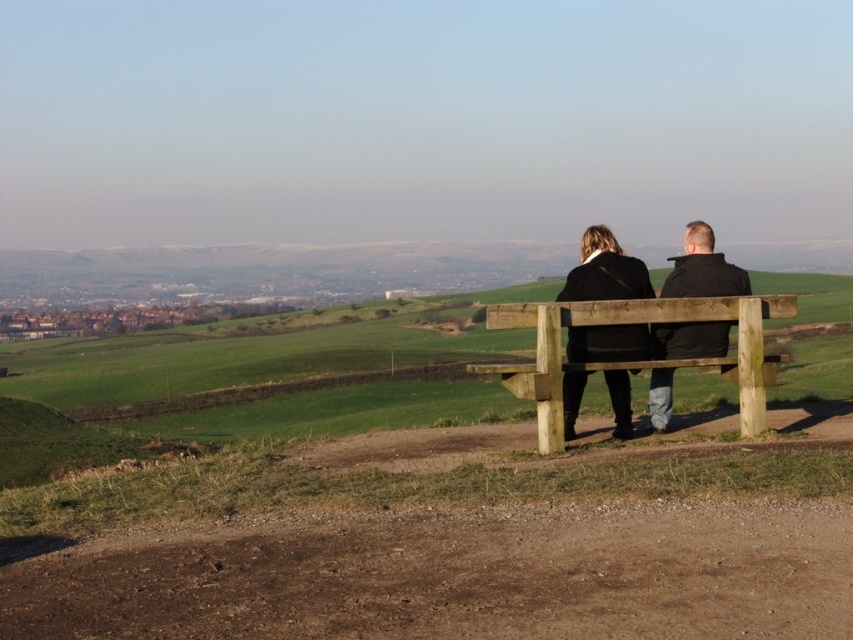
Question: Does black matte coat at center have a lesser width compared to black leather jacket at center?

Choices:
 (A) no
 (B) yes

Answer: (A)

Question: Considering the relative positions of wooden bench at center and black matte coat at center in the image provided, where is wooden bench at center located with respect to black matte coat at center?

Choices:
 (A) above
 (B) below

Answer: (A)

Question: Is wooden bench at center wider than black leather jacket at center?

Choices:
 (A) no
 (B) yes

Answer: (B)

Question: Which of the following is the farthest from the observer?

Choices:
 (A) (645, 269)
 (B) (648, 401)

Answer: (B)

Question: Which of the following is the farthest from the observer?

Choices:
 (A) wooden bench at center
 (B) black matte coat at center

Answer: (B)

Question: Estimate the real-world distances between objects in this image. Which object is farther from the wooden bench at center?

Choices:
 (A) black matte coat at center
 (B) black leather jacket at center

Answer: (B)